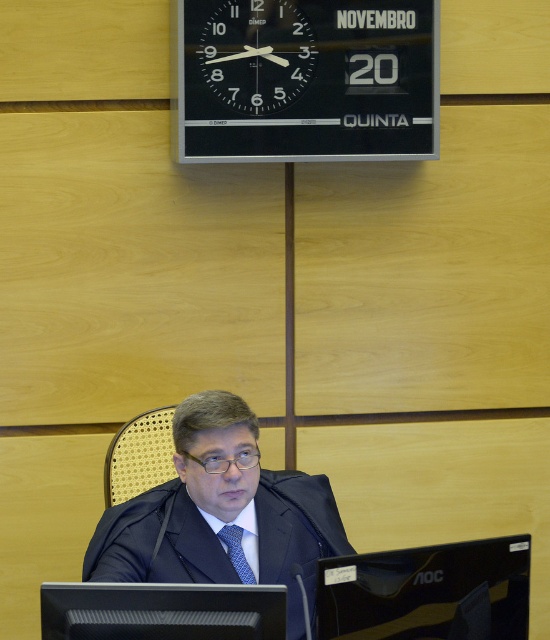
Question: Observing the image, what is the correct spatial positioning of black matte computer monitor at lower center in reference to black glass clock at upper center?

Choices:
 (A) right
 (B) left

Answer: (B)

Question: Is black matte computer monitor at lower center closer to camera compared to blue silk tie at center?

Choices:
 (A) yes
 (B) no

Answer: (A)

Question: Does black glossy monitor at lower center have a lesser width compared to black glass clock at upper center?

Choices:
 (A) no
 (B) yes

Answer: (A)

Question: Which point appears closest to the camera in this image?

Choices:
 (A) [x=239, y=572]
 (B) [x=163, y=472]
 (C) [x=518, y=628]

Answer: (C)

Question: Estimate the real-world distances between objects in this image. Which object is farther from the matte black suit at center?

Choices:
 (A) blue silk tie at center
 (B) black matte computer monitor at lower center
 (C) woven wood chair at center

Answer: (C)

Question: Which is farther from the black glossy monitor at lower center?

Choices:
 (A) black matte computer monitor at lower center
 (B) blue silk tie at center
 (C) matte black suit at center
 (D) woven wood chair at center

Answer: (D)